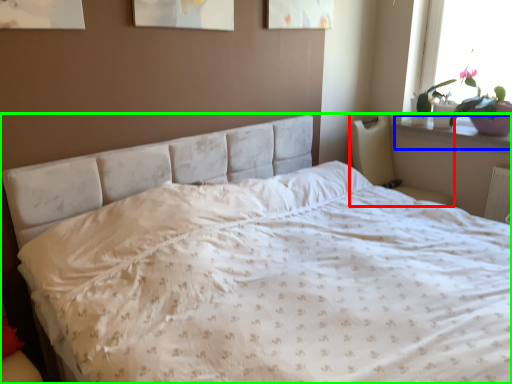
Question: Estimate the real-world distances between objects in this image. Which object is closer to armchair (highlighted by a red box), window sill (highlighted by a blue box) or bed (highlighted by a green box)?

Choices:
 (A) window sill
 (B) bed

Answer: (A)